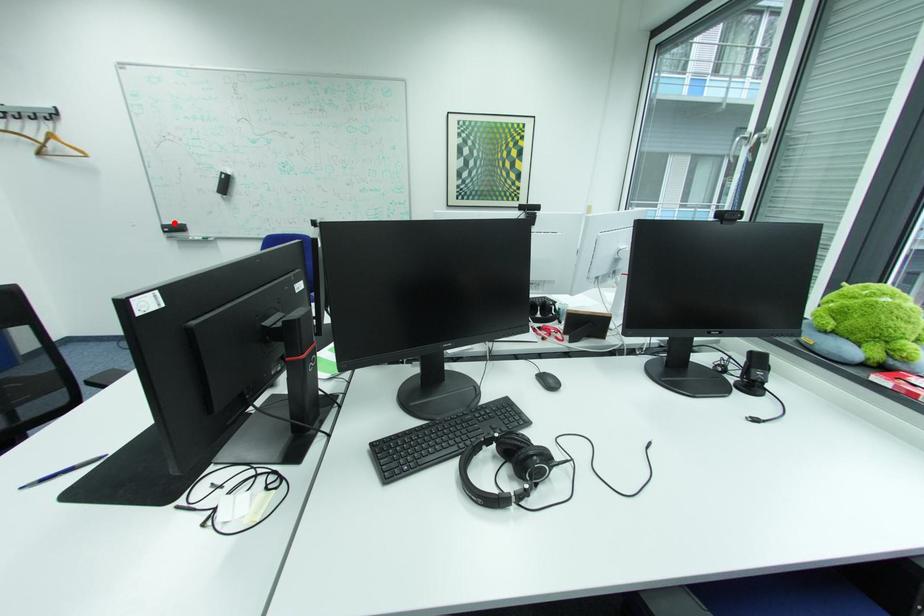
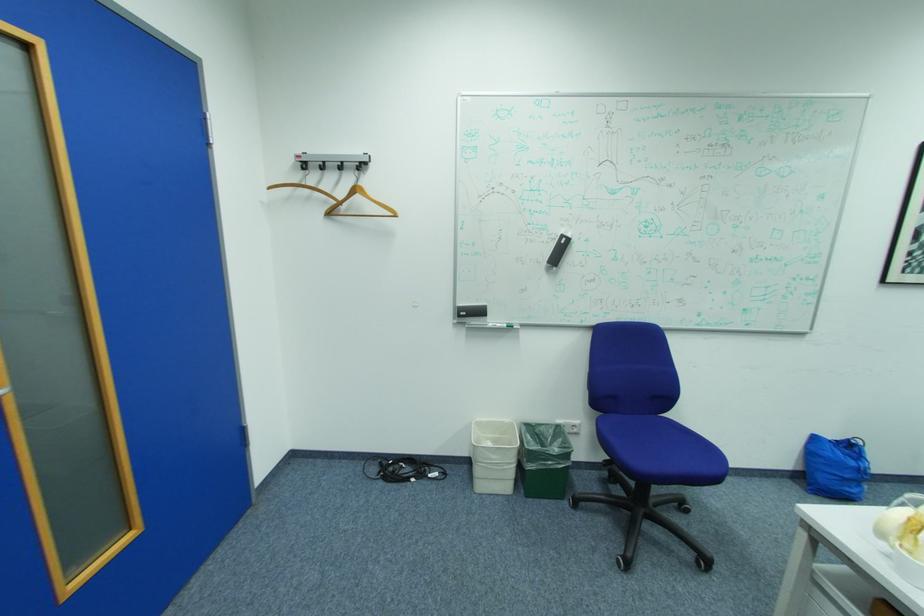
Where in the second image is the point corresponding to the highlighted location from the first image?

(469, 305)